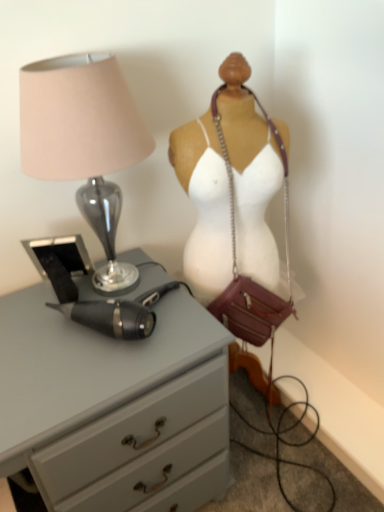
The width and height of the screenshot is (384, 512). What are the coordinates of `free point above matte gray chest of drawers at left (from a real-world perspective)` in the screenshot? It's located at (72, 330).